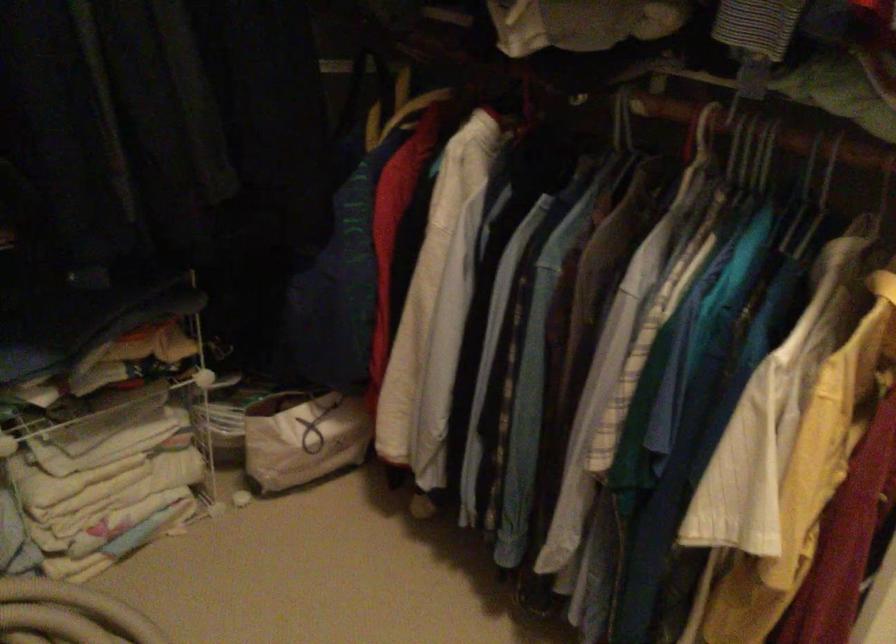
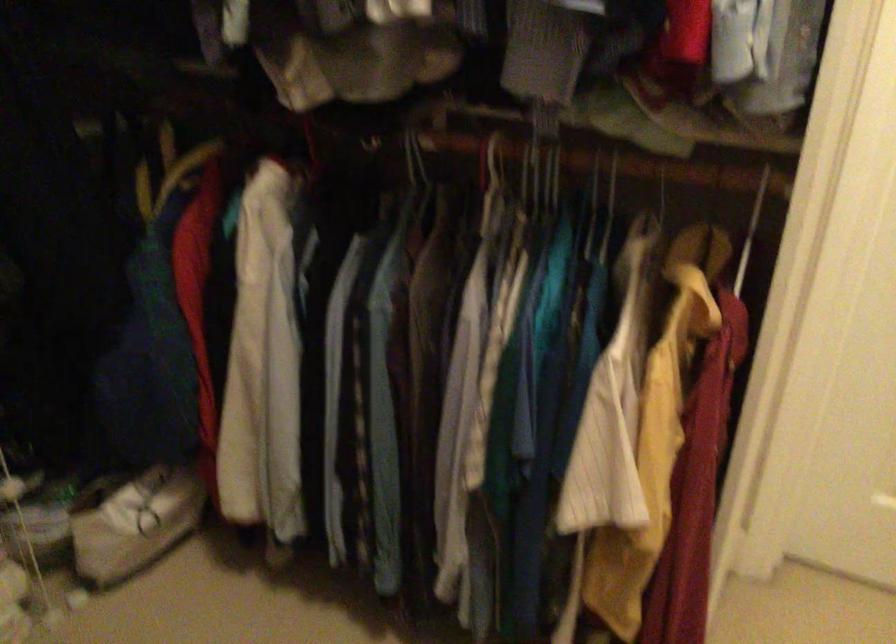
Where in the second image is the point corresponding to point 762,160 from the first image?

(554, 176)